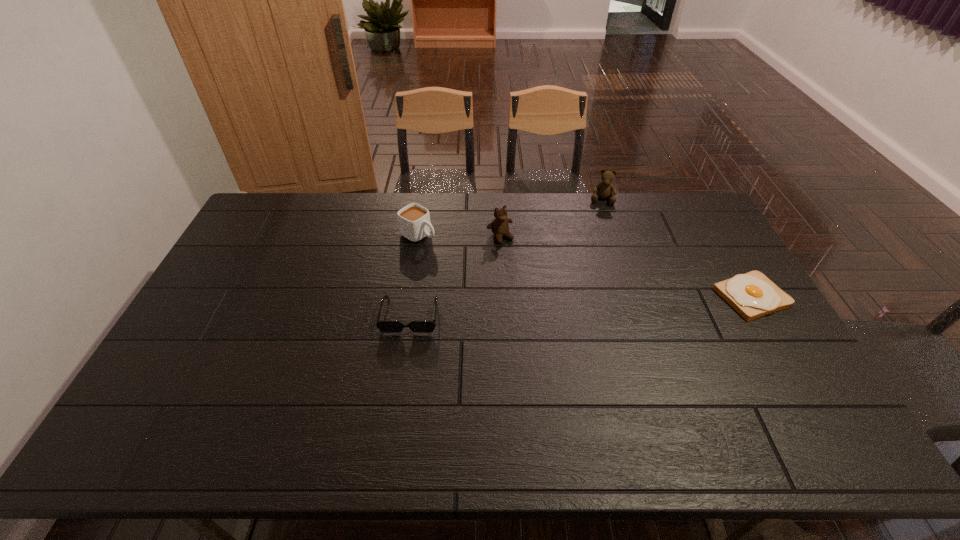
The image size is (960, 540). Identify the location of vacant space on the desktop that is between the sunglasses and the toast and is positioned at the face of the nearer teddy bear. (553, 308).

Where is `free spot on the desktop that is between the second shortest object and the rightmost object and is positioned on the front-facing side of the farthest object`? The image size is (960, 540). free spot on the desktop that is between the second shortest object and the rightmost object and is positioned on the front-facing side of the farthest object is located at coordinates (590, 306).

Where is `free spot on the desktop that is between the second shortest object and the shortest object and is positioned on the side with the handle of the cup`? free spot on the desktop that is between the second shortest object and the shortest object and is positioned on the side with the handle of the cup is located at coordinates (546, 308).